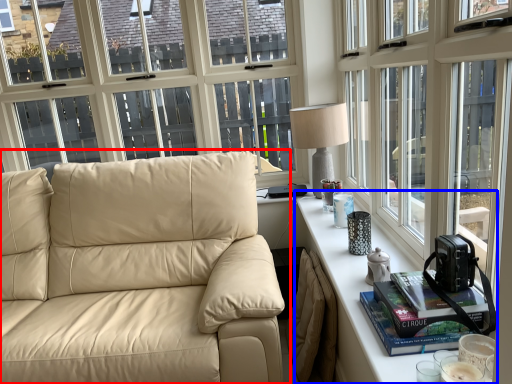
Question: Which point is closer to the camera, studio couch (highlighted by a red box) or table (highlighted by a blue box)?

Choices:
 (A) studio couch
 (B) table

Answer: (B)